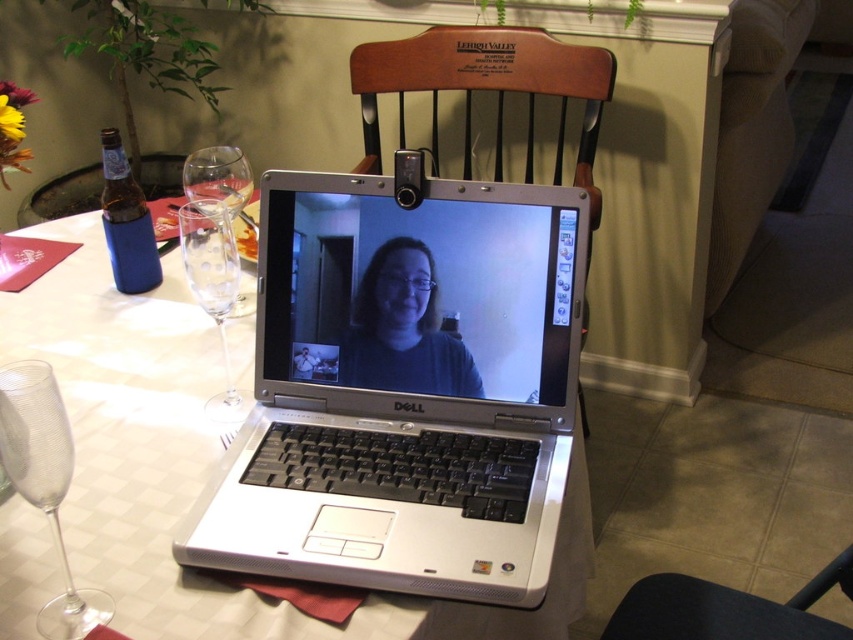
Question: Does clear textured glass at lower left appear under clear glass wine glass at left?

Choices:
 (A) yes
 (B) no

Answer: (A)

Question: From the image, what is the correct spatial relationship of transparent glass at left in relation to blue neoprene bottle at left?

Choices:
 (A) left
 (B) right

Answer: (B)

Question: Does wooden chair at center appear over black fabric chair at lower right?

Choices:
 (A) yes
 (B) no

Answer: (A)

Question: Which point appears farthest from the camera in this image?

Choices:
 (A) (666, 605)
 (B) (216, 544)

Answer: (A)

Question: Which point is closer to the camera?

Choices:
 (A) clear glass wine glass at left
 (B) black fabric chair at lower right
 (C) wooden chair at center
 (D) silver/black laptop at center

Answer: (D)

Question: Among these objects, which one is farthest from the camera?

Choices:
 (A) black fabric chair at lower right
 (B) transparent glass at left

Answer: (A)